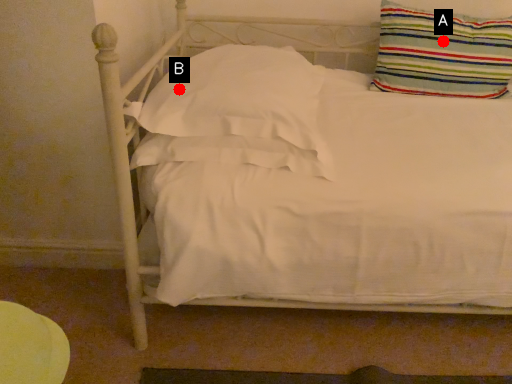
Question: Two points are circled on the image, labeled by A and B beside each circle. Which point is farther from the camera taking this photo?

Choices:
 (A) A is further
 (B) B is further

Answer: (A)